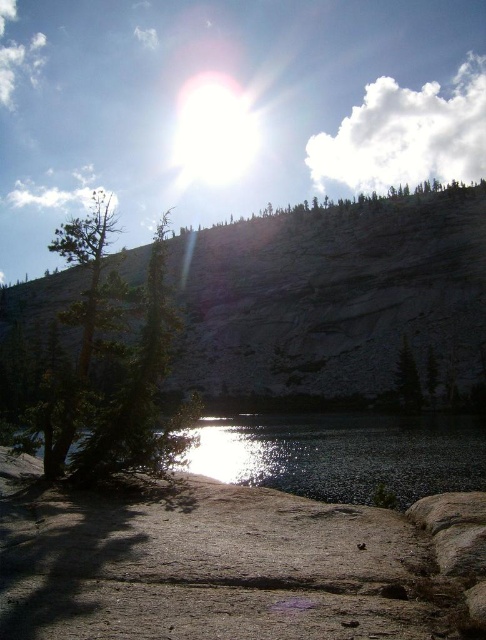
You are standing at the base of the rocky hillside and see the point labeled as point (344, 454). Based on the scene description, what is the location of this point relative to the small tree with sparse foliage?

The point (344, 454) is located at the smooth gray water at lower left, which is to the left side of the small tree with sparse foliage.

You are a hiker trying to determine which tree has a larger width. You see the green matte tree at lower left and the green matte tree at center. Based on the scene, which tree is wider?

The green matte tree at lower left is wider than the green matte tree at center according to the description.